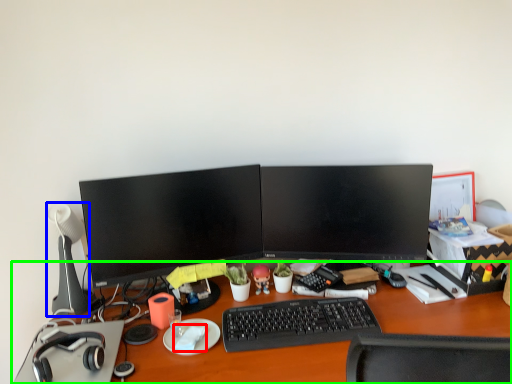
Question: Which object is positioned farthest from notepad (highlighted by a red box)? Select from table lamp (highlighted by a blue box) and desk (highlighted by a green box).

Choices:
 (A) table lamp
 (B) desk

Answer: (A)